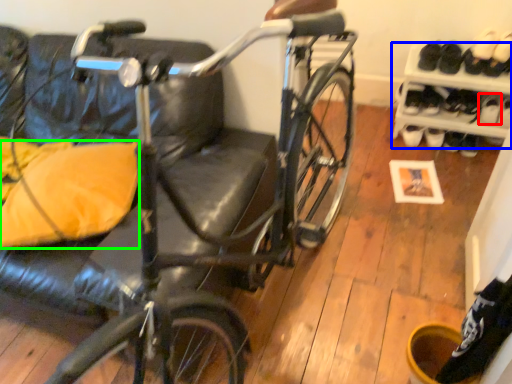
Question: Which object is positioned closest to shoe (highlighted by a red box)? Select from shelf (highlighted by a blue box) and pillow (highlighted by a green box).

Choices:
 (A) shelf
 (B) pillow

Answer: (A)